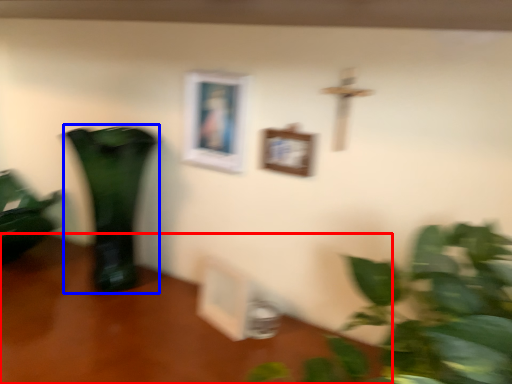
Question: Which object appears closest to the camera in this image, table (highlighted by a red box) or vase (highlighted by a blue box)?

Choices:
 (A) table
 (B) vase

Answer: (A)